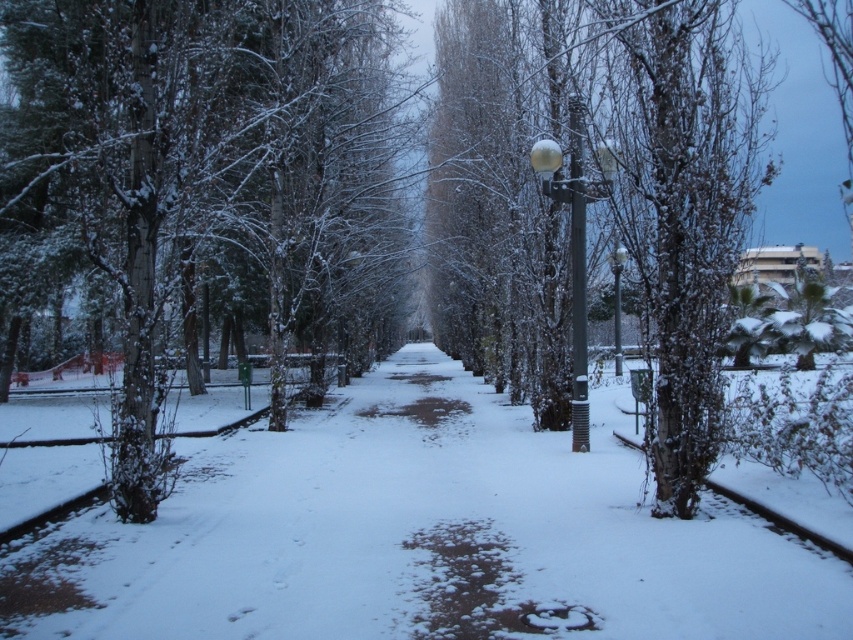
Question: Which point appears farthest from the camera in this image?

Choices:
 (A) (573, 451)
 (B) (616, 248)
 (C) (577, 305)

Answer: (B)

Question: From the image, what is the correct spatial relationship of sleek metallic lamp post at center in relation to glossy metal lamp post at center-right?

Choices:
 (A) above
 (B) below

Answer: (A)

Question: Is snow-covered tree at left wider than snow-covered tree at center?

Choices:
 (A) no
 (B) yes

Answer: (A)

Question: Can you confirm if snow-covered tree at left is wider than glossy metal lamp post at center-right?

Choices:
 (A) yes
 (B) no

Answer: (A)

Question: Which of these objects is positioned farthest from the snow-covered tree at center?

Choices:
 (A) sleek metallic lamp post at center
 (B) white snow-covered pavement at center

Answer: (B)

Question: Which of the following is the farthest from the observer?

Choices:
 (A) snow-covered tree at left
 (B) snow-covered tree at center
 (C) metallic gray pole at center
 (D) sleek metallic lamp post at center

Answer: (C)